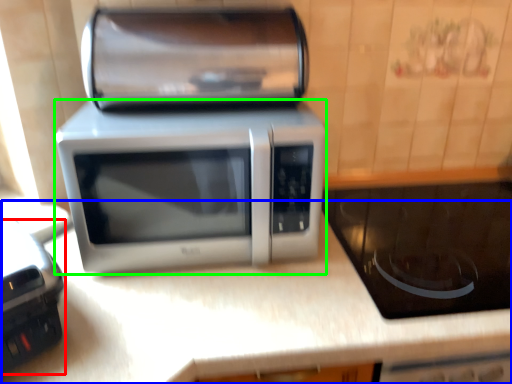
Question: Which object is the closest to the appliance (highlighted by a red box)? Choose among these: counter top (highlighted by a blue box) or microwave oven (highlighted by a green box).

Choices:
 (A) counter top
 (B) microwave oven

Answer: (A)